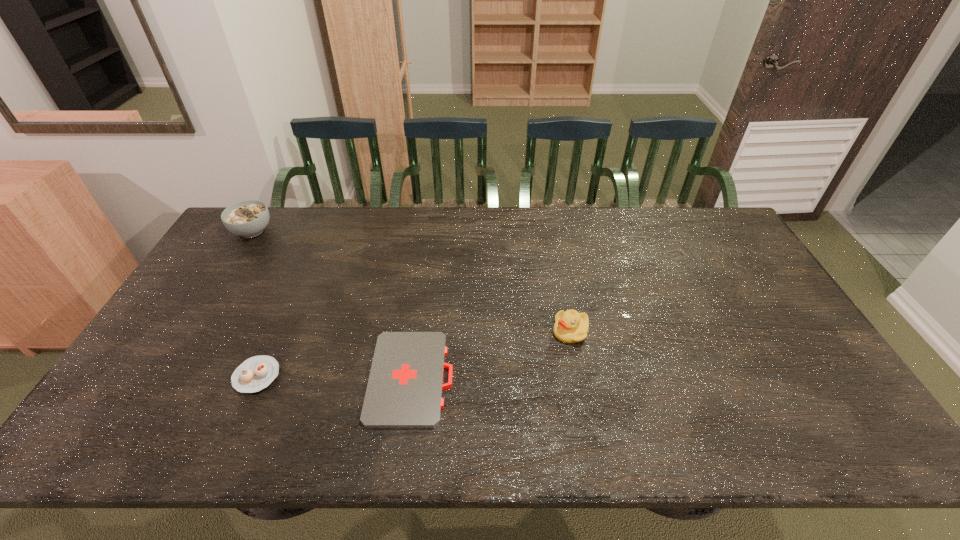
At what (x,y) coordinates should I click in order to perform the action: click on vacant space located 0.290m on the beak of the duckling. Please return your answer as a coordinate pair (x, y). The image size is (960, 540). Looking at the image, I should click on (448, 332).

Where is `free region located 0.160m on the left of the third tallest object`? Image resolution: width=960 pixels, height=540 pixels. free region located 0.160m on the left of the third tallest object is located at coordinates (172, 376).

Identify the location of free space located on handle side the shortest object. Image resolution: width=960 pixels, height=540 pixels. (598, 378).

This screenshot has height=540, width=960. I want to click on object situated at the far edge, so click(248, 218).

Image resolution: width=960 pixels, height=540 pixels. Identify the location of object present at the near edge. (404, 391).

Identify the location of object at the left edge. Image resolution: width=960 pixels, height=540 pixels. (248, 218).

Locate an element on the screen. The image size is (960, 540). object that is positioned at the far left corner is located at coordinates (248, 218).

Identify the location of free region at the far edge. (397, 211).

Image resolution: width=960 pixels, height=540 pixels. Find the location of `vacant space at the near edge of the desktop`. vacant space at the near edge of the desktop is located at coordinates (229, 450).

I want to click on vacant region at the left edge, so click(170, 363).